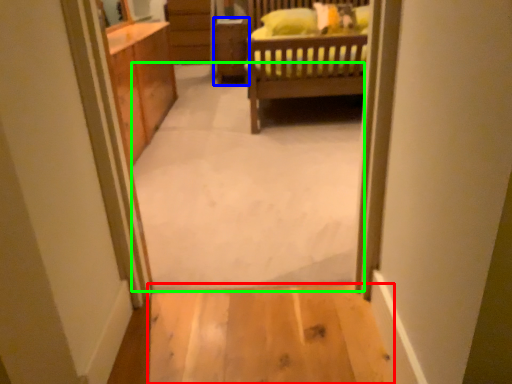
Question: Which is farther away from plain (highlighted by a red box)? cabinetry (highlighted by a blue box) or plain (highlighted by a green box)?

Choices:
 (A) cabinetry
 (B) plain

Answer: (A)